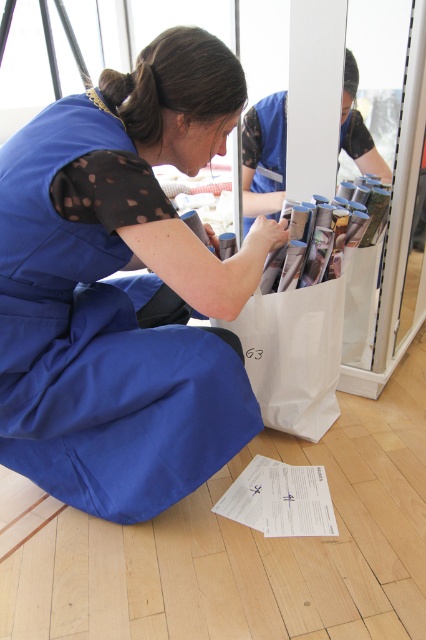
Is white paper bag at lower center behind white paper at lower center?

Yes, it is behind white paper at lower center.

Measure the distance between white paper bag at lower center and white paper at lower center.

white paper bag at lower center is 11.73 inches away from white paper at lower center.

Is point (333, 394) farther from camera compared to point (265, 493)?

Yes, point (333, 394) is farther from viewer.

Find the location of `white paper bag at lower center`. white paper bag at lower center is located at coordinates (293, 355).

Is blue fabric dress at center thinner than white paper bag at lower center?

In fact, blue fabric dress at center might be wider than white paper bag at lower center.

Which is more to the left, blue fabric dress at center or white paper bag at lower center?

From the viewer's perspective, blue fabric dress at center appears more on the left side.

Who is more forward, (86,504) or (259,346)?

Point (86,504)

I want to click on blue fabric dress at center, so click(123, 289).

Between point (190, 163) and point (282, 492), which one is positioned behind?

The point (282, 492) is behind.

Which is in front, point (63, 188) or point (264, 477)?

Point (63, 188)

Does point (19, 227) come farther from viewer compared to point (311, 490)?

No, (19, 227) is in front of (311, 490).

Locate an element on the screen. blue fabric dress at center is located at coordinates (123, 289).